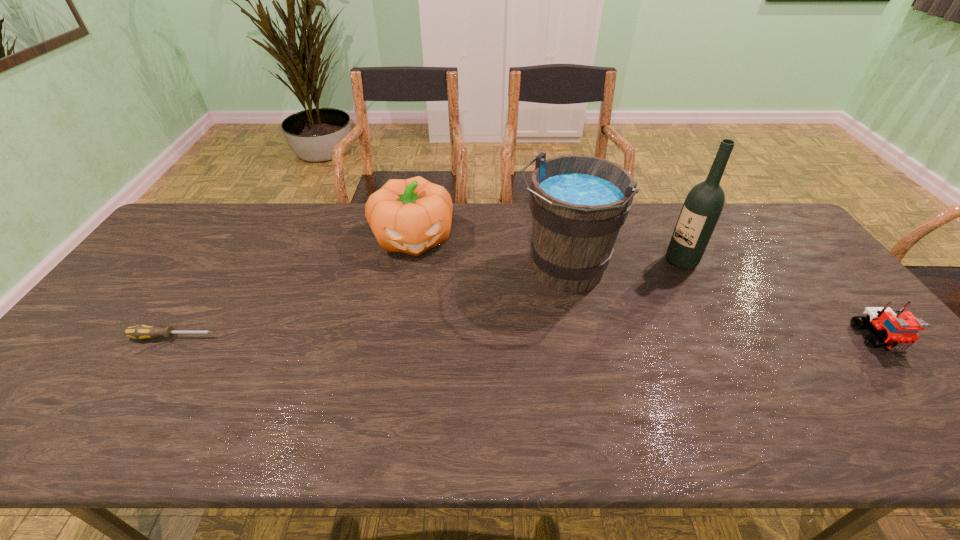
The height and width of the screenshot is (540, 960). What are the coordinates of `screwdriver` in the screenshot? It's located at (140, 332).

You are a GUI agent. You are given a task and a screenshot of the screen. Output one action in this format:
    pyautogui.click(x=<x>, y=<y>)
    Task: Click on the shortest object
    Image resolution: width=960 pixels, height=540 pixels.
    Given the screenshot: What is the action you would take?
    pyautogui.click(x=140, y=332)

At what (x,y) coordinates should I click in order to perform the action: click on the second shortest object. Please return your answer as a coordinate pair (x, y). The width and height of the screenshot is (960, 540). Looking at the image, I should click on (898, 330).

At what (x,y) coordinates should I click in order to perform the action: click on Lego. Please return your answer as a coordinate pair (x, y). Looking at the image, I should click on [898, 330].

The height and width of the screenshot is (540, 960). I want to click on wine bottle, so click(703, 205).

At what (x,y) coordinates should I click in order to perform the action: click on the fourth shortest object. Please return your answer as a coordinate pair (x, y). The image size is (960, 540). Looking at the image, I should click on (579, 203).

Where is `wine bucket`? wine bucket is located at coordinates (579, 203).

Locate an element on the screen. The width and height of the screenshot is (960, 540). pumpkin is located at coordinates (412, 215).

Locate an element on the screen. The height and width of the screenshot is (540, 960). the fourth object from right to left is located at coordinates (412, 215).

What are the coordinates of `vacant point located at the tip of the shortest object` in the screenshot? It's located at (329, 337).